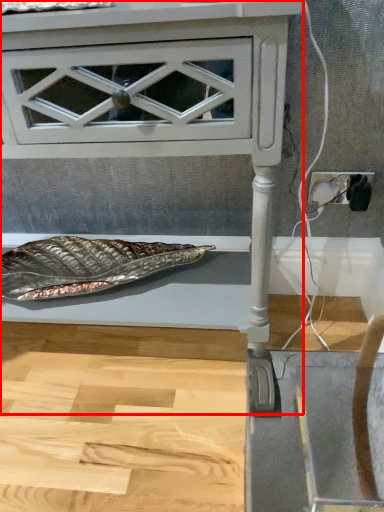
Question: From the image's perspective, where is furniture (annotated by the red box) located in relation to electric outlet in the image?

Choices:
 (A) below
 (B) above

Answer: (A)